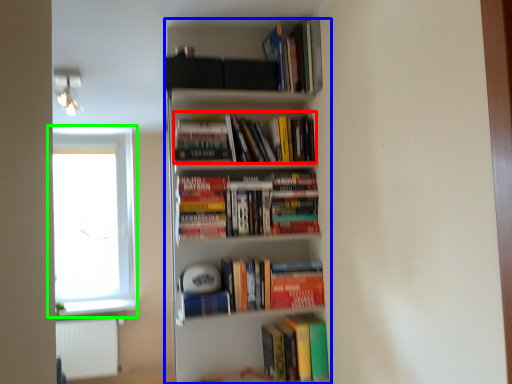
Question: Which object is positioned closest to book (highlighted by a red box)? Select from bookcase (highlighted by a blue box) and window (highlighted by a green box).

Choices:
 (A) bookcase
 (B) window

Answer: (A)